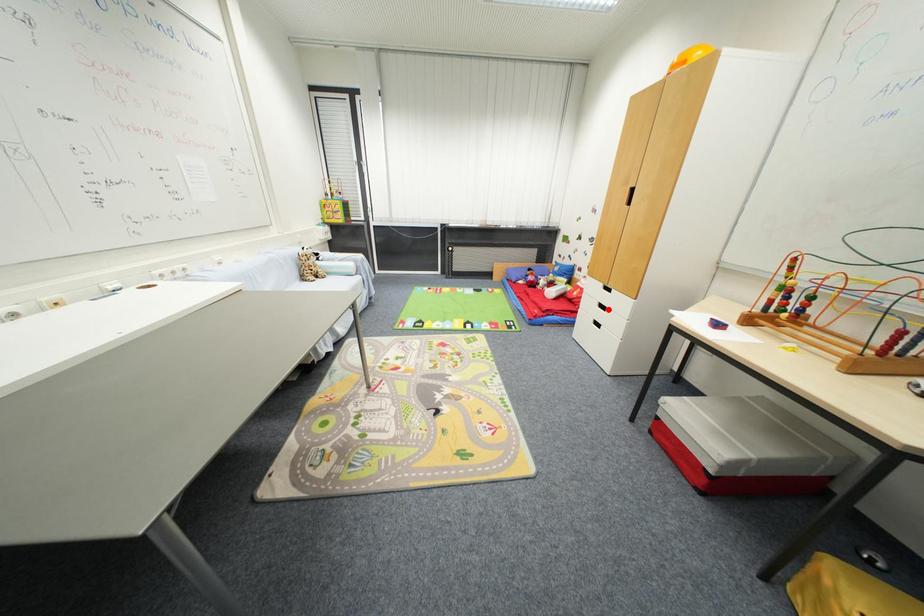
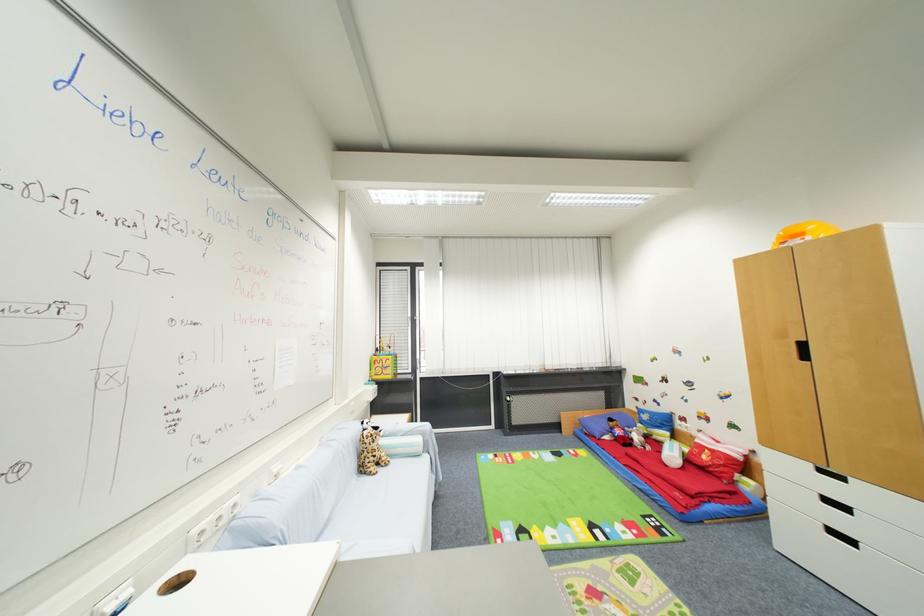
The point at the highlighted location is marked in the first image. Where is the corresponding point in the second image?

(849, 509)